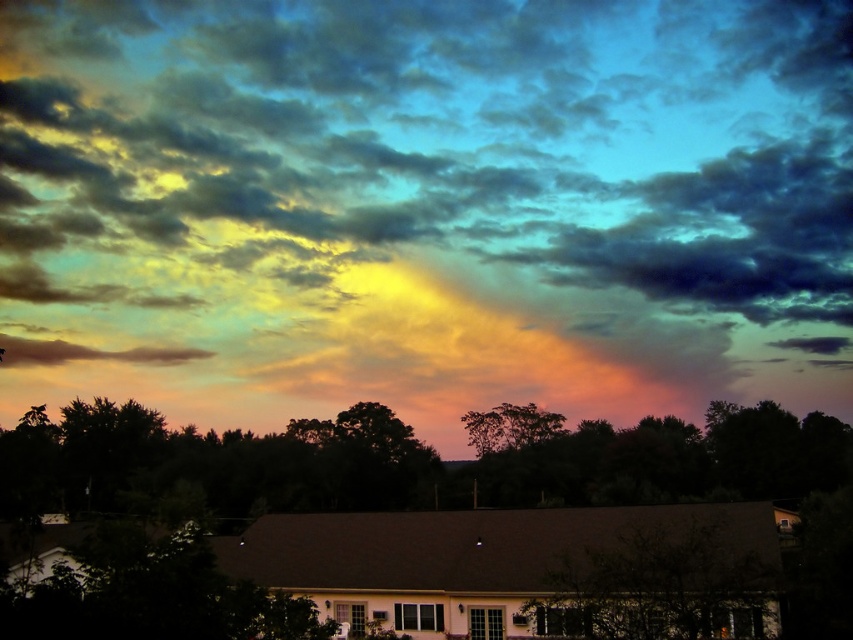
You are an architect designing a new residential building and want to ensure that the windows of the house will not be blocked by clouds. Based on the scene, which object between the cloudy sky at upper center and the matte brown cloud at lower left is more likely to block the view from the house windows?

The matte brown cloud at lower left is more likely to block the view from the house windows since it is positioned closer to the house compared to the cloudy sky at upper center, which is larger but farther away.

You are standing at the center of the image and want to walk towards the green leafy tree at lower center. Which direction should you move in?

The green leafy tree at lower center is located at coordinates 0.917 on the x axis and 0.775 on the y axis. Since you are at the center, which is at coordinates 0.5 on both axes, you should move towards the right and down to reach the green leafy tree at lower center.